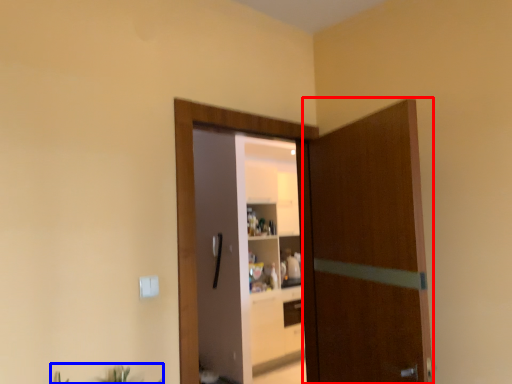
Question: Which point is further to the camera, door (highlighted by a red box) or plant (highlighted by a blue box)?

Choices:
 (A) door
 (B) plant

Answer: (A)